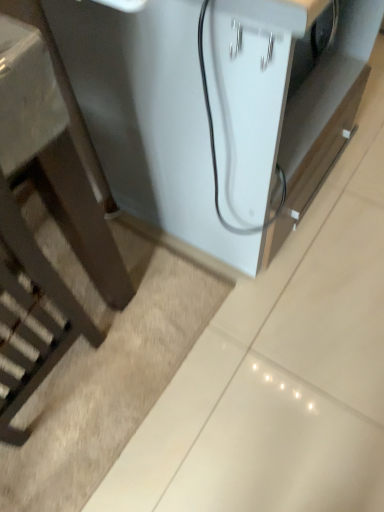
Where is `white glossy water dispenser at center`? The height and width of the screenshot is (512, 384). white glossy water dispenser at center is located at coordinates (217, 108).

This screenshot has width=384, height=512. What do you see at coordinates (217, 108) in the screenshot?
I see `white glossy water dispenser at center` at bounding box center [217, 108].

This screenshot has width=384, height=512. What are the coordinates of `white glossy water dispenser at center` in the screenshot? It's located at (217, 108).